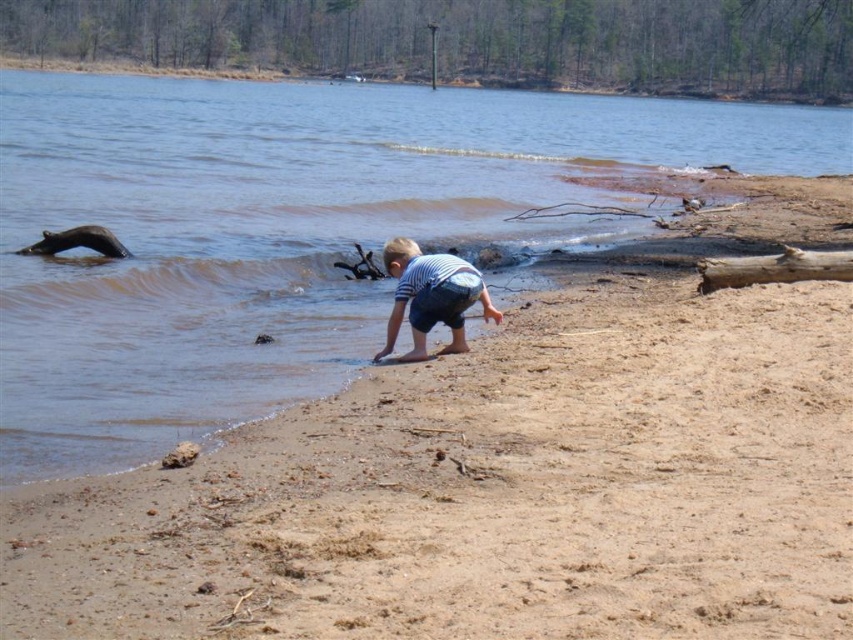
Question: Which point is closer to the camera?

Choices:
 (A) brown sandy beach at lower center
 (B) striped cotton shirt at lower center
 (C) brown rough wood log at right

Answer: (A)

Question: Which object is closer to the camera taking this photo?

Choices:
 (A) brown rough wood log at right
 (B) brown sandy beach at lower center

Answer: (B)

Question: Is brown sandy beach at lower center bigger than striped cotton shirt at lower center?

Choices:
 (A) yes
 (B) no

Answer: (A)

Question: Is brown sandy beach at lower center to the left of striped cotton shirt at lower center from the viewer's perspective?

Choices:
 (A) yes
 (B) no

Answer: (B)

Question: Among these points, which one is nearest to the camera?

Choices:
 (A) pos(412,284)
 (B) pos(849,208)

Answer: (A)

Question: Can you confirm if brown sandy beach at lower center is positioned to the left of brown rough wood log at right?

Choices:
 (A) yes
 (B) no

Answer: (A)